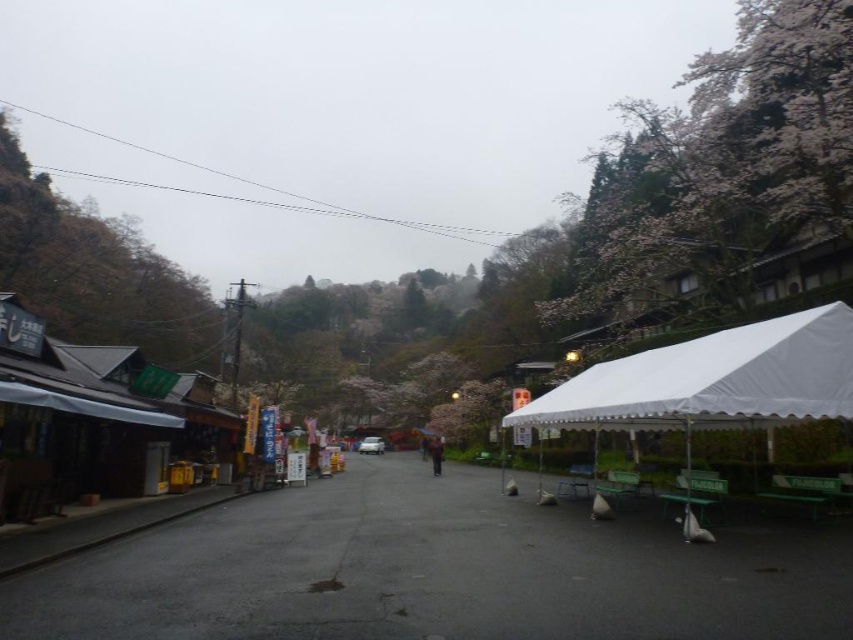
Is the position of white blossoming tree at upper right less distant than that of white fabric tent at right?

No, white blossoming tree at upper right is behind white fabric tent at right.

Which is in front, point (625, 273) or point (556, 404)?

Positioned in front is point (556, 404).

At what (x,y) coordinates should I click in order to perform the action: click on white blossoming tree at upper right. Please return your answer as a coordinate pair (x, y). The width and height of the screenshot is (853, 640). Looking at the image, I should click on (723, 164).

Does white blossoming tree at upper right appear on the left side of brown textured tree at left?

In fact, white blossoming tree at upper right is to the right of brown textured tree at left.

Does white blossoming tree at upper right have a lesser width compared to brown textured tree at left?

In fact, white blossoming tree at upper right might be wider than brown textured tree at left.

At what (x,y) coordinates should I click in order to perform the action: click on white blossoming tree at upper right. Please return your answer as a coordinate pair (x, y). This screenshot has width=853, height=640. Looking at the image, I should click on (723, 164).

The image size is (853, 640). Identify the location of white blossoming tree at upper right. (723, 164).

Can you confirm if brown textured tree at left is positioned to the right of dark blue jacket at center?

In fact, brown textured tree at left is to the left of dark blue jacket at center.

Is brown textured tree at left wider than dark blue jacket at center?

Indeed, brown textured tree at left has a greater width compared to dark blue jacket at center.

Does point (166, 292) come farther from viewer compared to point (432, 442)?

Yes, point (166, 292) is farther from viewer.

Identify the location of brown textured tree at left. Image resolution: width=853 pixels, height=640 pixels. (96, 273).